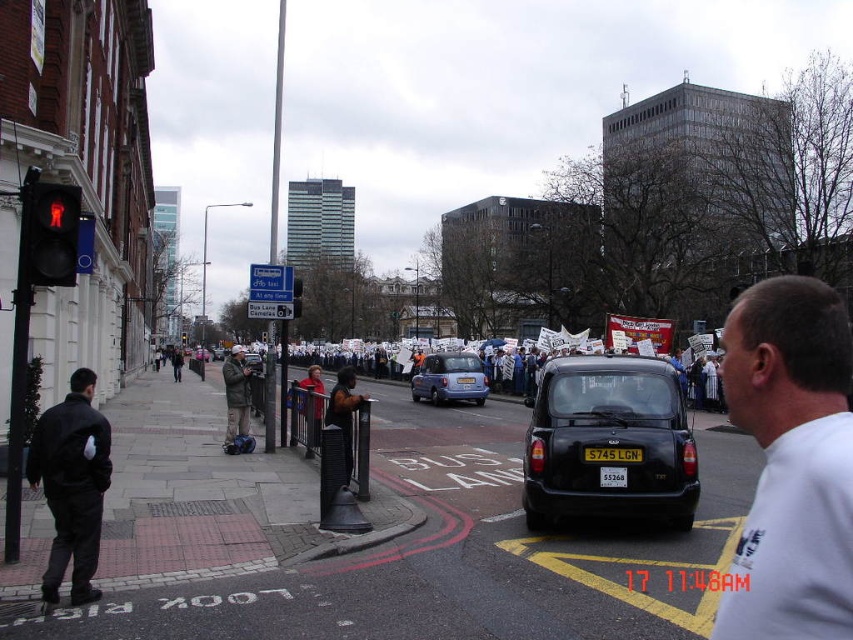
The image size is (853, 640). Find the location of `matte black taxi at center`. matte black taxi at center is located at coordinates (608, 442).

Is point (592, 440) closer to viewer compared to point (79, 483)?

No, (592, 440) is further to viewer.

Identify the location of matte black taxi at center. The height and width of the screenshot is (640, 853). (608, 442).

Does black leather jacket at left appear on the left side of matte blue car at center?

Correct, you'll find black leather jacket at left to the left of matte blue car at center.

Is black leather jacket at left above matte blue car at center?

Indeed, black leather jacket at left is positioned over matte blue car at center.

Who is more distant from viewer, (x=26, y=464) or (x=410, y=385)?

The point (x=410, y=385) is behind.

At what (x,y) coordinates should I click in order to perform the action: click on black leather jacket at left. Please return your answer as a coordinate pair (x, y). This screenshot has width=853, height=640. Looking at the image, I should click on (73, 484).

Consider the image. Is white shirt at center thinner than matte black taxi at center?

Yes.

I want to click on white shirt at center, so click(x=791, y=461).